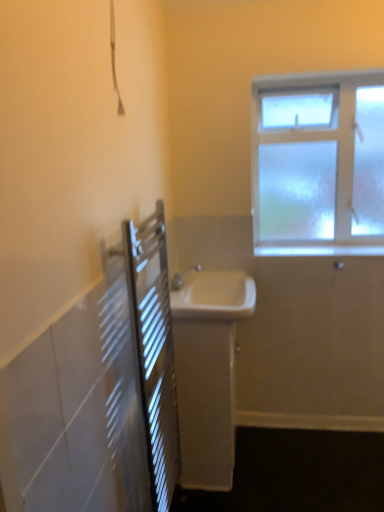
Question: From a real-world perspective, is metallic silver radiator at left positioned above or below white glossy window sill at upper right?

Choices:
 (A) below
 (B) above

Answer: (A)

Question: Is metallic silver radiator at left inside or outside of white glossy window sill at upper right?

Choices:
 (A) outside
 (B) inside

Answer: (A)

Question: Which object is positioned closest to the frosted glass window at upper right?

Choices:
 (A) white glossy sink at center, acting as the 1th sink starting from the top
 (B) metallic silver radiator at left
 (C) white glossy sink at center, the first sink ordered from the bottom
 (D) white glossy window sill at upper right

Answer: (D)

Question: Which of these objects is positioned closest to the white glossy window sill at upper right?

Choices:
 (A) white glossy sink at center, which is the second sink in top-to-bottom order
 (B) metallic silver radiator at left
 (C) frosted glass window at upper right
 (D) white glossy sink at center, acting as the second sink starting from the bottom

Answer: (C)